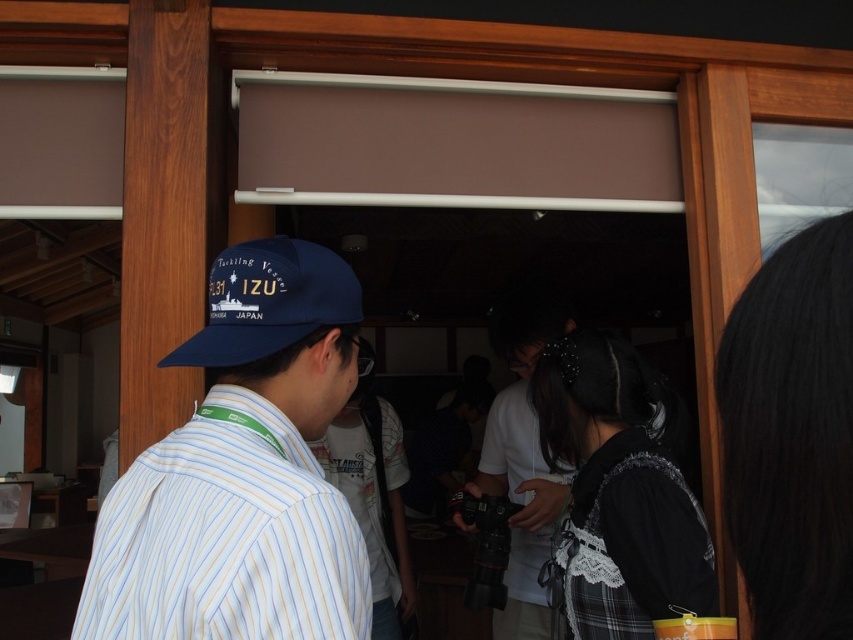
You are standing in the traditional Japanese building and want to take a photo of the blue fabric cap at center and the white matte shirt at center. Which object should you focus on first to ensure both are in the frame?

The blue fabric cap at center is in front of the white matte shirt at center, so you should focus on the white matte shirt at center first to ensure both are in the frame.

You are a photographer trying to capture a clear shot of the blue fabric cap at center and the striped cotton shirt at center. Which object should you zoom in on to ensure it fits entirely within your camera frame if the cap is wider?

The striped cotton shirt at center should be zoomed in on since the blue fabric cap at center is wider, meaning the shirt is narrower and would fit better in the frame without cropping.

You are a photographer trying to capture a group photo of the people in the scene. You notice the white matte shirt at center and the matte blue baseball cap at upper left. Which person should you focus on first to ensure they are in the frame, considering their sizes?

The white matte shirt at center is wider than the matte blue baseball cap at upper left, so focusing on the white matte shirt at center first will ensure both are in the frame since it occupies more space.